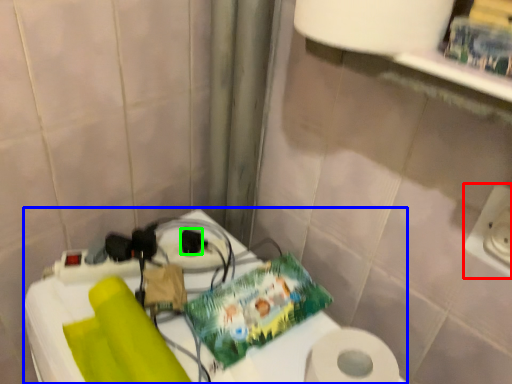
Question: Based on their relative distances, which object is nearer to electric outlet (highlighted by a red box)? Choose from table (highlighted by a blue box) and socket (highlighted by a green box).

Choices:
 (A) table
 (B) socket

Answer: (A)